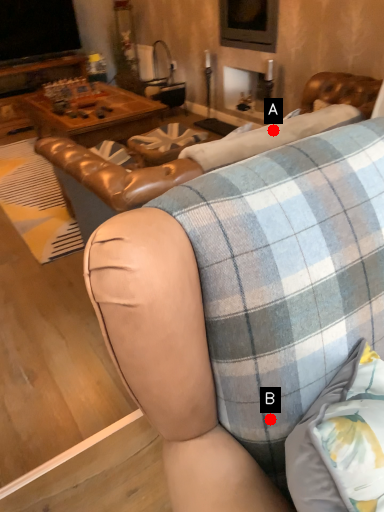
Question: Two points are circled on the image, labeled by A and B beside each circle. Which point is closer to the camera?

Choices:
 (A) A is closer
 (B) B is closer

Answer: (B)